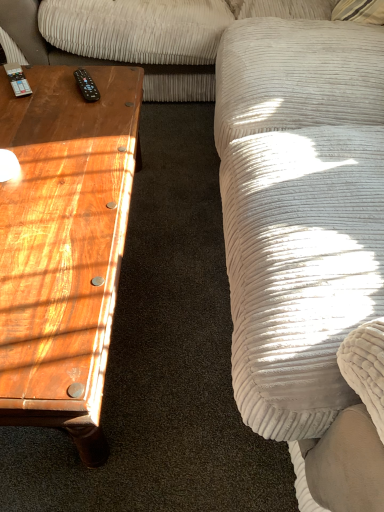
Question: From a real-world perspective, relative to wooden coffee table at left, is black plastic remote at upper left vertically above or below?

Choices:
 (A) above
 (B) below

Answer: (A)

Question: Considering the positions of black plastic remote at upper left and wooden coffee table at left in the image, is black plastic remote at upper left taller or shorter than wooden coffee table at left?

Choices:
 (A) tall
 (B) short

Answer: (B)

Question: Is black plastic remote at upper left bigger or smaller than wooden coffee table at left?

Choices:
 (A) big
 (B) small

Answer: (B)

Question: From the image's perspective, is wooden coffee table at left located above or below black plastic remote at upper left?

Choices:
 (A) below
 (B) above

Answer: (A)

Question: In terms of size, does wooden coffee table at left appear bigger or smaller than black plastic remote at upper left?

Choices:
 (A) big
 (B) small

Answer: (A)

Question: Is wooden coffee table at left inside the boundaries of black plastic remote at upper left, or outside?

Choices:
 (A) outside
 (B) inside

Answer: (A)

Question: Considering the relative positions of wooden coffee table at left and black plastic remote at upper left in the image provided, is wooden coffee table at left to the left or to the right of black plastic remote at upper left?

Choices:
 (A) right
 (B) left

Answer: (B)